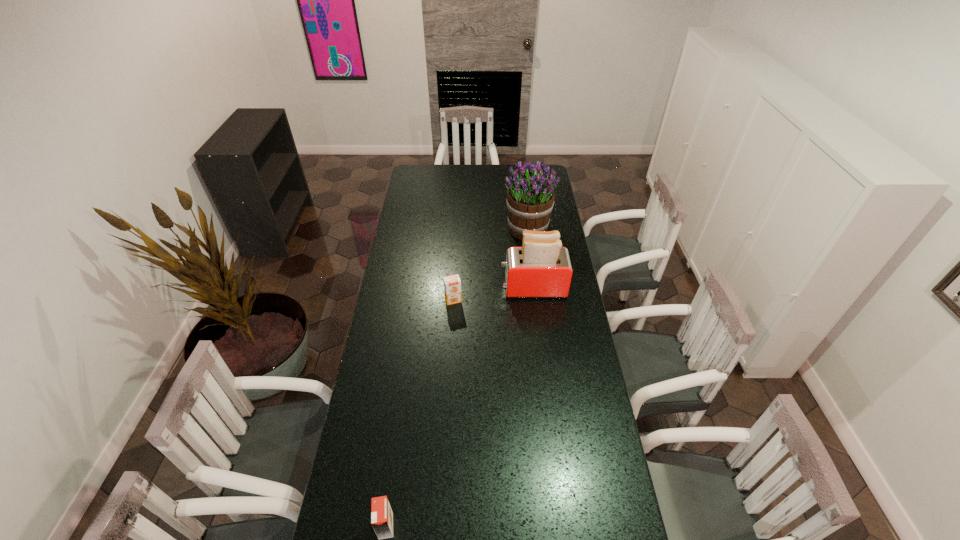
You are a GUI agent. You are given a task and a screenshot of the screen. Output one action in this format:
    pyautogui.click(x=<x>, y=<y>)
    Task: Click on the free space between the bouquet and the nearer orange juice
    
    Given the screenshot: What is the action you would take?
    pyautogui.click(x=457, y=377)

This screenshot has width=960, height=540. In order to click on vacant area that lies between the left orange juice and the tallest object in this screenshot , I will do `click(457, 377)`.

Find the location of a particular element. Image resolution: width=960 pixels, height=540 pixels. unoccupied area between the nearest object and the second object from left to right is located at coordinates (420, 413).

What are the coordinates of `vacant point located between the nearest object and the third object from right to left` in the screenshot? It's located at (420, 413).

In order to click on unoccupied area between the nearest object and the tallest object in this screenshot , I will do `click(457, 377)`.

Locate an element on the screen. The image size is (960, 540). free point between the nearer orange juice and the farther orange juice is located at coordinates (420, 413).

Where is `blank region between the leftmost object and the toaster`? blank region between the leftmost object and the toaster is located at coordinates (460, 407).

Identify the location of empty space that is in between the nearest object and the second tallest object. (460, 407).

You are a GUI agent. You are given a task and a screenshot of the screen. Output one action in this format:
    pyautogui.click(x=<x>, y=<y>)
    Task: Click on the vacant space that's between the second tallest object and the second object from left to right
    The height and width of the screenshot is (540, 960).
    Given the screenshot: What is the action you would take?
    pyautogui.click(x=493, y=294)

You are a GUI agent. You are given a task and a screenshot of the screen. Output one action in this format:
    pyautogui.click(x=<x>, y=<y>)
    Task: Click on the third closest object to the leftmost object
    The height and width of the screenshot is (540, 960).
    Given the screenshot: What is the action you would take?
    pyautogui.click(x=530, y=197)